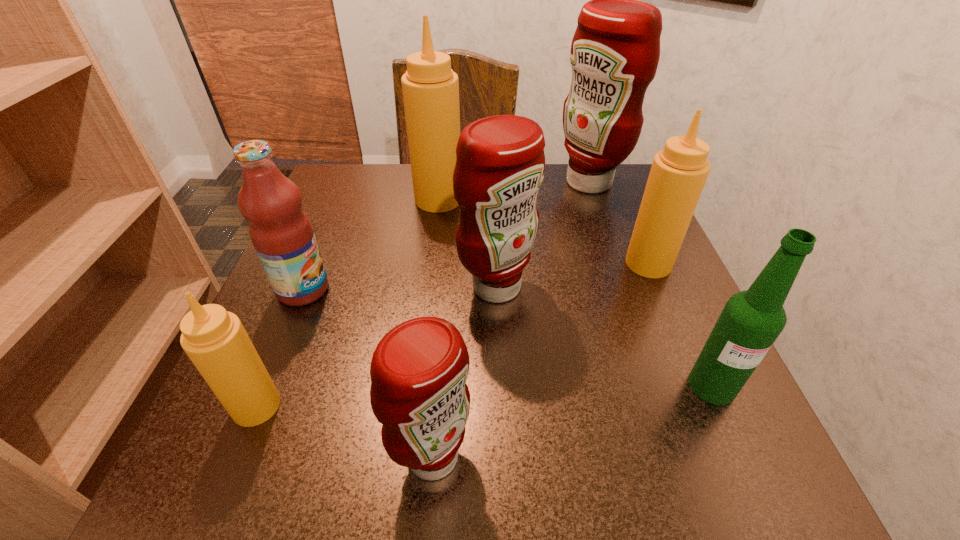
What are the coordinates of `object that is at the near edge` in the screenshot? It's located at (419, 369).

This screenshot has width=960, height=540. Find the location of `fruit juice that is at the left edge`. fruit juice that is at the left edge is located at coordinates (281, 232).

This screenshot has width=960, height=540. I want to click on condiment that is positioned at the left edge, so click(214, 339).

This screenshot has height=540, width=960. Identify the location of beer bottle at the right edge. (751, 321).

This screenshot has width=960, height=540. I want to click on object that is at the far right corner, so click(615, 51).

This screenshot has width=960, height=540. I want to click on vacant space at the near edge, so click(521, 463).

Find the location of a particular element. The width and height of the screenshot is (960, 540). free space at the left edge of the desktop is located at coordinates (347, 342).

You are a GUI agent. You are given a task and a screenshot of the screen. Output one action in this format:
    pyautogui.click(x=<x>, y=<y>)
    Task: Click on the vacant space at the right edge of the desktop
    
    Given the screenshot: What is the action you would take?
    click(x=708, y=409)

The height and width of the screenshot is (540, 960). What are the coordinates of `vacant area at the far left corner` in the screenshot? It's located at (361, 168).

The width and height of the screenshot is (960, 540). Identify the location of vacant space at the near right corner of the desktop. (745, 454).